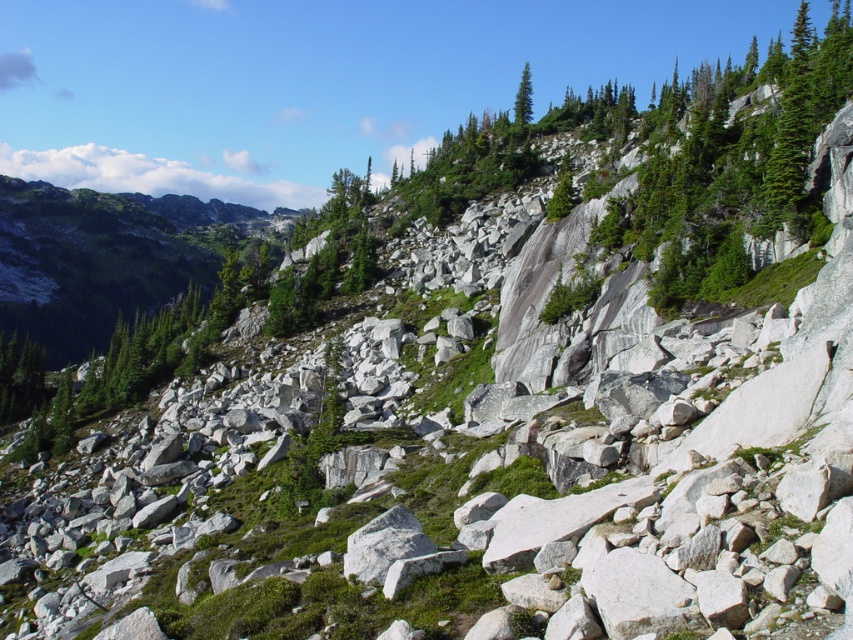
You are a hiker standing at the bottom of the mountain slope. You see a green mossy rock marked at point (102, 259). Based on the coordinates, is this rock located in the upper or lower part of the image?

The point (102, 259) indicates the green mossy rock at upper left, so it is located in the upper part of the image.

You are a hiker standing at the bottom of the mountain slope. You see the green mossy rock at upper left and the green textured tree at upper center. Which object is closer to you?

The green mossy rock at upper left is closer to you than the green textured tree at upper center because it is further to the viewer.